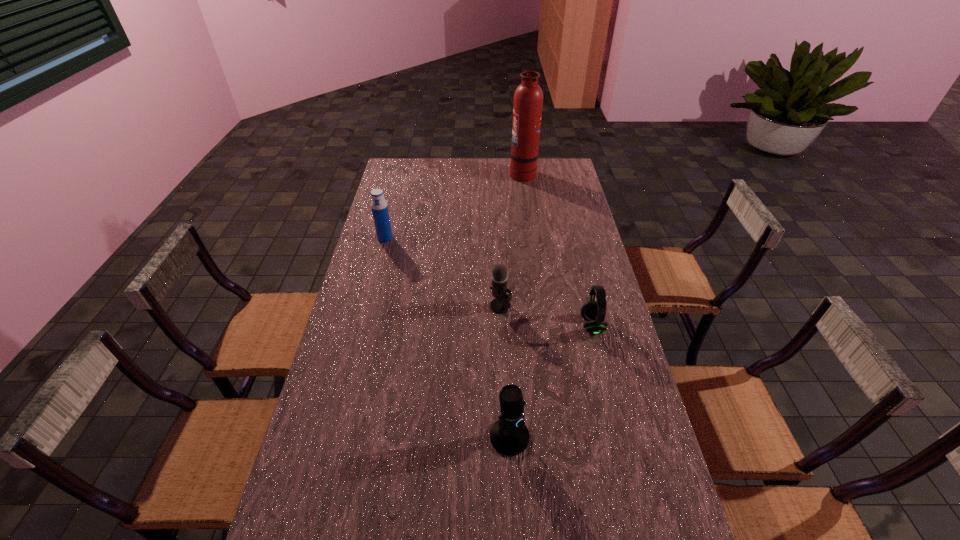
Image resolution: width=960 pixels, height=540 pixels. I want to click on blank area in the image that satisfies the following two spatial constraints: 1. on the label side of the tallest object; 2. on the front side of the farther microphone, so click(541, 306).

The image size is (960, 540). What are the coordinates of `free space that satisfies the following two spatial constraints: 1. on the label side of the farthest object; 2. on the front side of the farther microphone` in the screenshot? It's located at (541, 306).